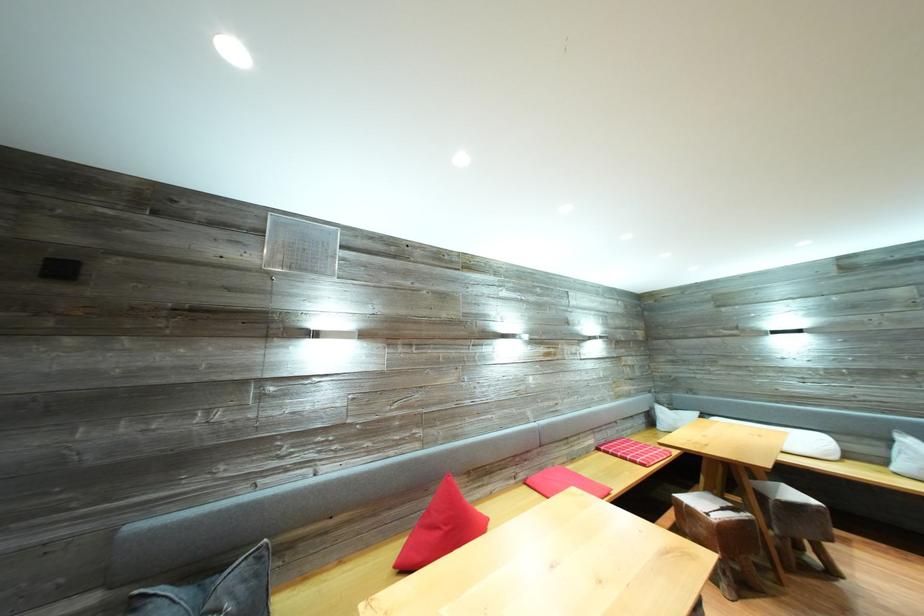
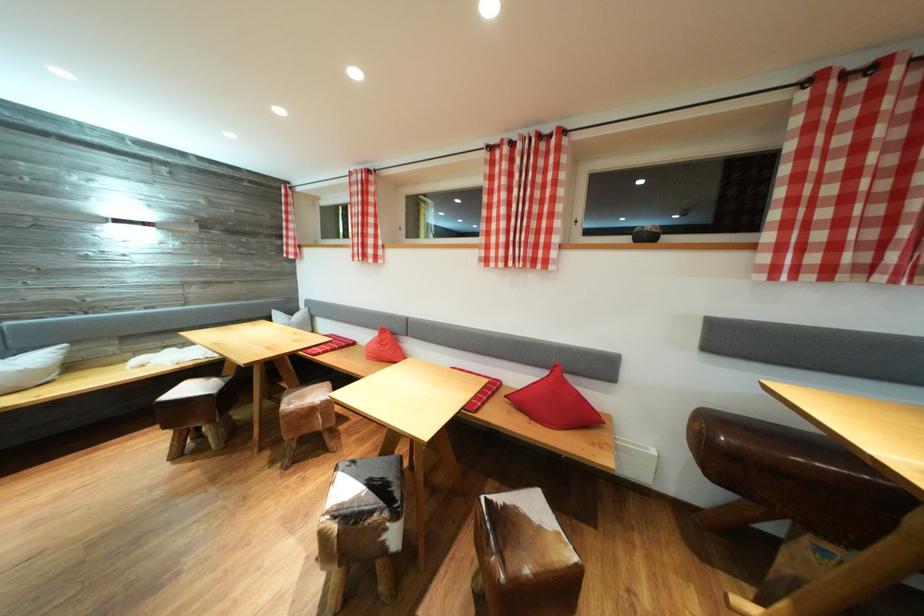
Question: The images are taken continuously from a first-person perspective. In which direction is your viewpoint rotating?

Choices:
 (A) Left
 (B) Right
 (C) Up
 (D) Down

Answer: (B)